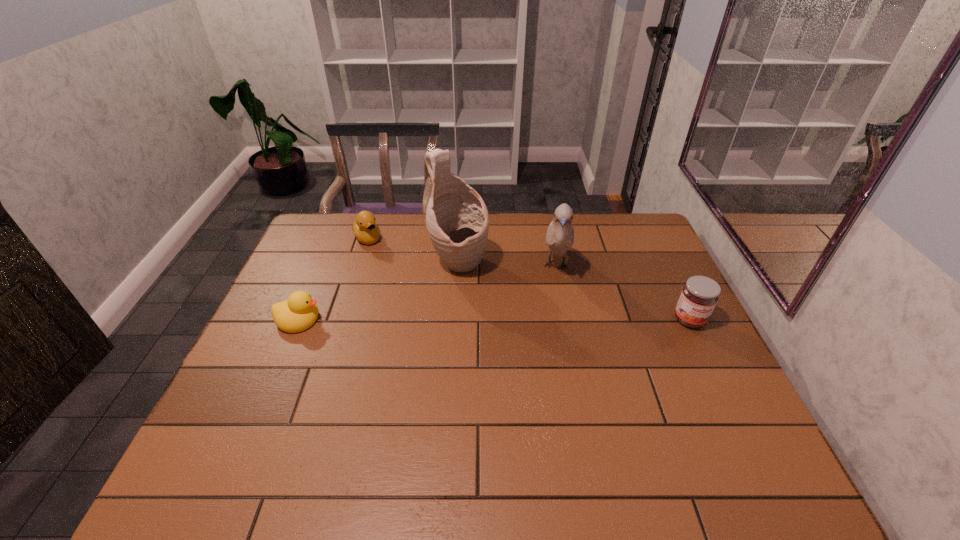
Locate an element on the screen. the shorter duckling is located at coordinates (299, 312).

Locate an element on the screen. The height and width of the screenshot is (540, 960). the leftmost object is located at coordinates (299, 312).

You are a GUI agent. You are given a task and a screenshot of the screen. Output one action in this format:
    pyautogui.click(x=<x>, y=<y>)
    Task: Click on the jam
    This screenshot has width=960, height=540.
    Given the screenshot: What is the action you would take?
    pyautogui.click(x=699, y=296)

This screenshot has width=960, height=540. In order to click on the right duckling in this screenshot , I will do `click(364, 228)`.

This screenshot has width=960, height=540. Find the location of `the taller duckling`. the taller duckling is located at coordinates (364, 228).

Find the location of `the third object from right to left`. the third object from right to left is located at coordinates (457, 220).

At what (x,y) coordinates should I click in order to perform the action: click on pitcher. Please return your answer as a coordinate pair (x, y). The image size is (960, 540). Looking at the image, I should click on (457, 220).

Where is `bird`? The height and width of the screenshot is (540, 960). bird is located at coordinates pos(560,234).

Locate an element on the screen. The height and width of the screenshot is (540, 960). the second object from right to left is located at coordinates (560, 234).

Where is `vacant position located on the face of the left duckling`? The height and width of the screenshot is (540, 960). vacant position located on the face of the left duckling is located at coordinates (422, 319).